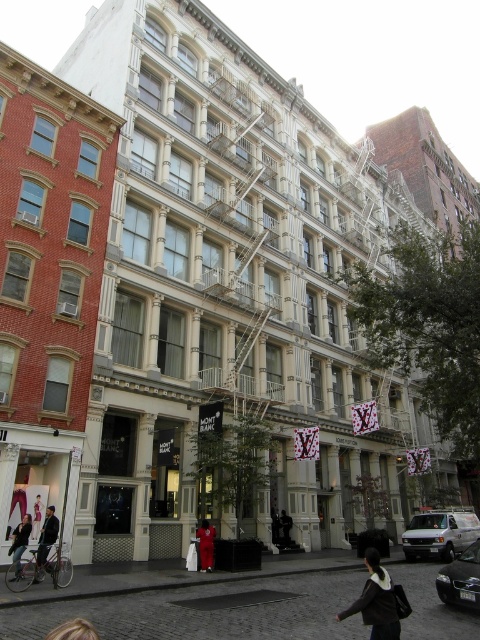
Is point (396, 636) closer to viewer compared to point (283, 536)?

Yes, point (396, 636) is closer to viewer.

Who is taller, dark brown leather jacket at lower right or dark gray fabric coat at center?

With more height is dark brown leather jacket at lower right.

I want to click on dark brown leather jacket at lower right, so click(x=375, y=600).

The image size is (480, 640). I want to click on dark brown leather jacket at lower right, so click(x=375, y=600).

Who is positioned more to the right, light brown hair at lower left or dark gray jacket at lower left?

From the viewer's perspective, light brown hair at lower left appears more on the right side.

Who is more forward, [48,636] or [28,529]?

Positioned in front is point [48,636].

Locate an element on the screen. This screenshot has width=480, height=640. light brown hair at lower left is located at coordinates (72, 630).

Does dark brown leather jacket at lower right have a smaller size compared to red fabric person at center?

Incorrect, dark brown leather jacket at lower right is not smaller in size than red fabric person at center.

What do you see at coordinates (375, 600) in the screenshot? This screenshot has width=480, height=640. I see `dark brown leather jacket at lower right` at bounding box center [375, 600].

Does point (377, 596) come behind point (211, 561)?

No, it is not.

This screenshot has height=640, width=480. Identify the location of dark brown leather jacket at lower right. (375, 600).